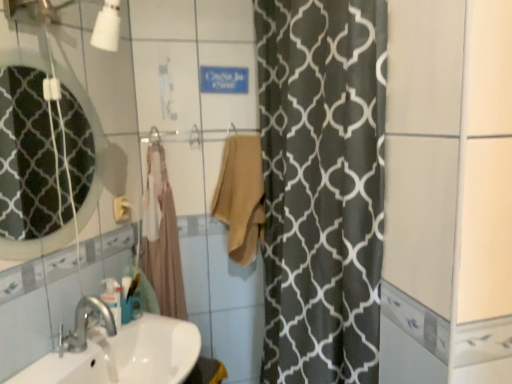
Question: From a real-world perspective, relative to white glossy sink at lower left, is matte glass mirror at upper left vertically above or below?

Choices:
 (A) above
 (B) below

Answer: (A)

Question: Does point (27, 210) appear closer or farther from the camera than point (18, 375)?

Choices:
 (A) closer
 (B) farther

Answer: (B)

Question: Considering the real-world distances, which object is farthest from the beige cotton bath towel at center, acting as the first bath towel starting from the left?

Choices:
 (A) translucent plastic soap dispenser at lower left
 (B) matte glass mirror at upper left
 (C) beige cotton towel at center, the second bath towel in the left-to-right sequence
 (D) white glossy sink at lower left

Answer: (B)

Question: Considering the real-world distances, which object is farthest from the beige cotton towel at center, the second bath towel in the left-to-right sequence?

Choices:
 (A) white glossy sink at lower left
 (B) matte glass mirror at upper left
 (C) translucent plastic soap dispenser at lower left
 (D) beige cotton bath towel at center, marked as the 2th bath towel in a right-to-left arrangement

Answer: (B)